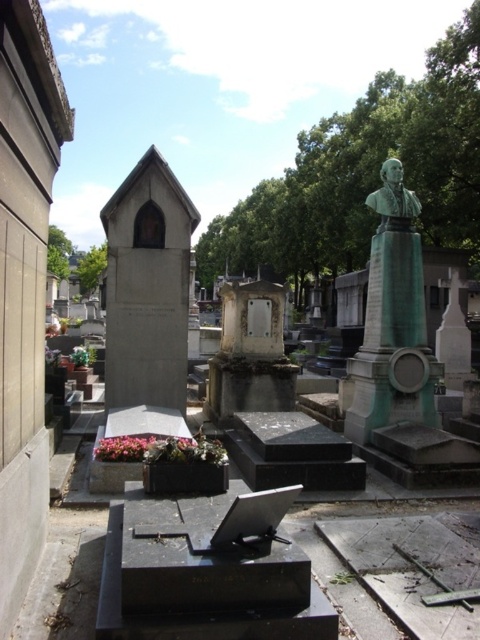
Question: Is white marble tombstone at center wider than green polished stone bust at center?

Choices:
 (A) no
 (B) yes

Answer: (B)

Question: Which of the following is the closest to the observer?

Choices:
 (A) green polished stone bust at center
 (B) white marble tombstone at center

Answer: (A)

Question: Is white marble tombstone at center thinner than green polished stone bust at center?

Choices:
 (A) no
 (B) yes

Answer: (A)

Question: Does white marble tombstone at center have a smaller size compared to green polished stone bust at center?

Choices:
 (A) no
 (B) yes

Answer: (A)

Question: Which point is closer to the camera?

Choices:
 (A) white marble tombstone at center
 (B) green polished stone bust at center

Answer: (B)